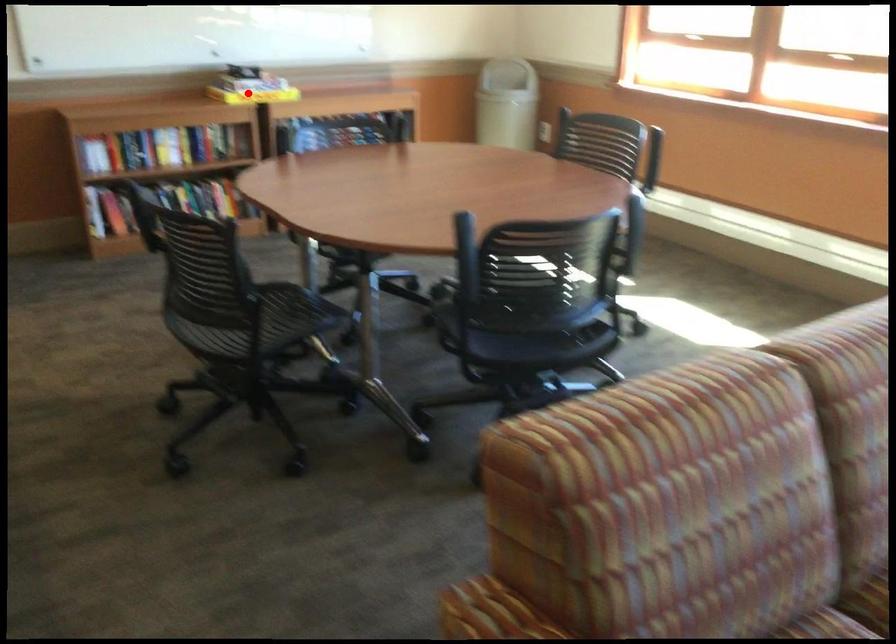
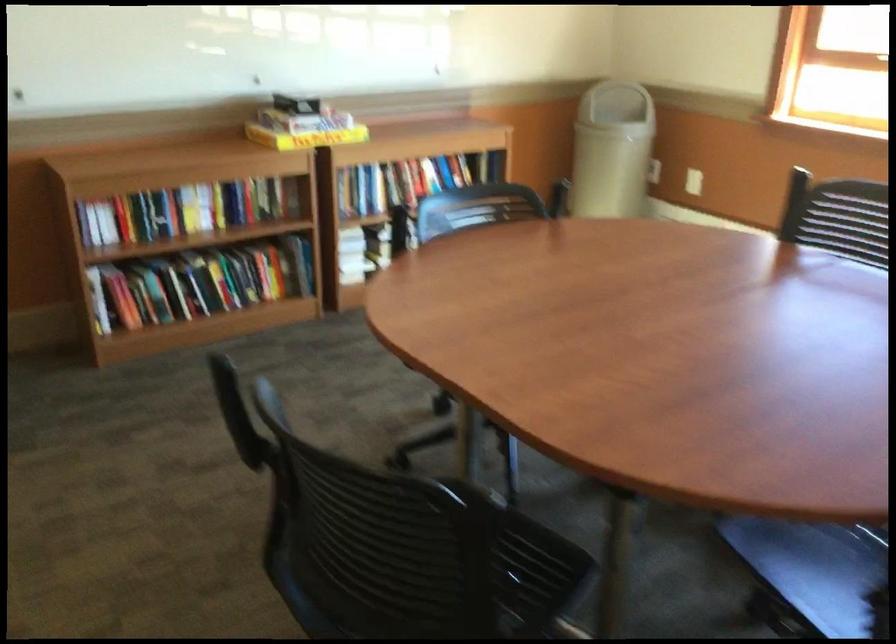
Question: I am providing you with two images of the same scene from different viewpoints. Image1 has a red point marked. In image2, the corresponding 3D location appears at what relative position? Reply with the corresponding letter.

Choices:
 (A) Closer
 (B) Farther

Answer: (A)